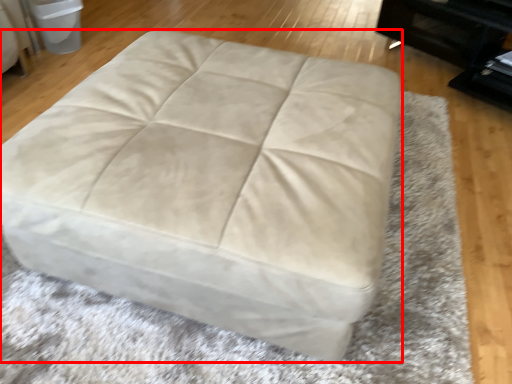
Question: Where is furniture (annotated by the red box) located in relation to bean bag chair in the image?

Choices:
 (A) left
 (B) right

Answer: (B)